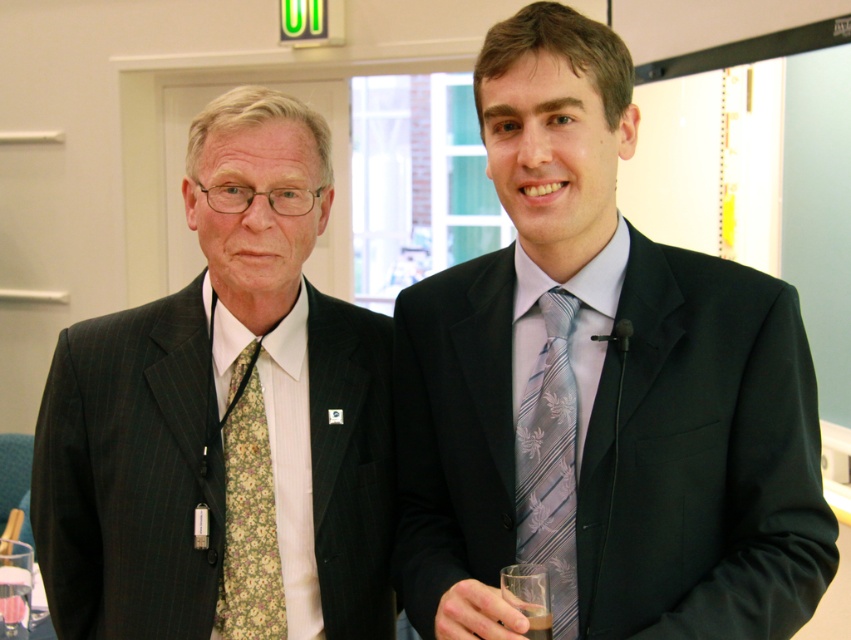
Is floral-patterned fabric tie at left in front of translucent glass at lower right?

No, it is behind translucent glass at lower right.

Does floral-patterned fabric tie at left have a smaller size compared to translucent glass at lower right?

No.

Is point (241, 372) positioned in front of point (507, 600)?

No, (241, 372) is further to viewer.

At what (x,y) coordinates should I click in order to perform the action: click on floral-patterned fabric tie at left. Please return your answer as a coordinate pair (x, y). The image size is (851, 640). Looking at the image, I should click on (248, 515).

Looking at this image, is silvery-gray floral tie at center-right bigger than translucent glass at lower right?

Yes, silvery-gray floral tie at center-right is bigger than translucent glass at lower right.

Between silvery-gray floral tie at center-right and translucent glass at lower right, which one appears on the right side from the viewer's perspective?

silvery-gray floral tie at center-right

Who is more distant from viewer, (521, 518) or (533, 625)?

The point (521, 518) is behind.

Where is `silvery-gray floral tie at center-right`? This screenshot has width=851, height=640. silvery-gray floral tie at center-right is located at coordinates (550, 464).

In the scene shown: Who is more distant from viewer, (x=810, y=531) or (x=560, y=420)?

The point (x=560, y=420) is behind.

Can you confirm if silk tie at center is positioned below silvery-gray floral tie at center-right?

Incorrect, silk tie at center is not positioned below silvery-gray floral tie at center-right.

Is point (683, 576) behind point (532, 512)?

No, (683, 576) is closer to viewer.

At what (x,y) coordinates should I click in order to perform the action: click on silk tie at center. Please return your answer as a coordinate pair (x, y). Looking at the image, I should click on (598, 390).